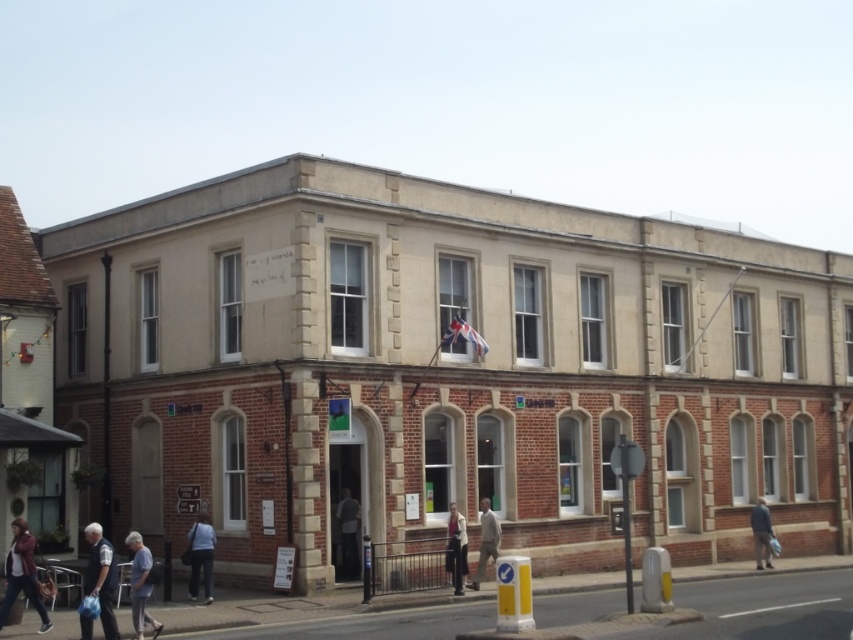
Does light blue shirt at lower left appear on the right side of dark blue jacket at lower right?

In fact, light blue shirt at lower left is to the left of dark blue jacket at lower right.

Does light blue shirt at lower left have a lesser height compared to dark blue jacket at lower right?

Yes, light blue shirt at lower left is shorter than dark blue jacket at lower right.

Image resolution: width=853 pixels, height=640 pixels. What are the coordinates of `light blue shirt at lower left` in the screenshot? It's located at (140, 584).

The height and width of the screenshot is (640, 853). I want to click on light blue shirt at lower left, so click(140, 584).

Which of these two, white cotton shirt at lower left or light beige fabric jacket at center, stands taller?

Standing taller between the two is white cotton shirt at lower left.

Can you confirm if white cotton shirt at lower left is wider than light beige fabric jacket at center?

Yes, white cotton shirt at lower left is wider than light beige fabric jacket at center.

Does point (94, 566) come behind point (462, 541)?

No, it is in front of (462, 541).

Where is `white cotton shirt at lower left`? The image size is (853, 640). white cotton shirt at lower left is located at coordinates (102, 577).

Is point (97, 564) positioned before point (347, 548)?

Yes.

Is white cotton shirt at lower left wider than dark gray fabric jacket at center?

Yes, white cotton shirt at lower left is wider than dark gray fabric jacket at center.

You are a GUI agent. You are given a task and a screenshot of the screen. Output one action in this format:
    pyautogui.click(x=<x>, y=<y>)
    Task: Click on the white cotton shirt at lower left
    This screenshot has height=640, width=853.
    Given the screenshot: What is the action you would take?
    click(x=102, y=577)

Find the location of `white cotton shirt at lower left`. white cotton shirt at lower left is located at coordinates (102, 577).